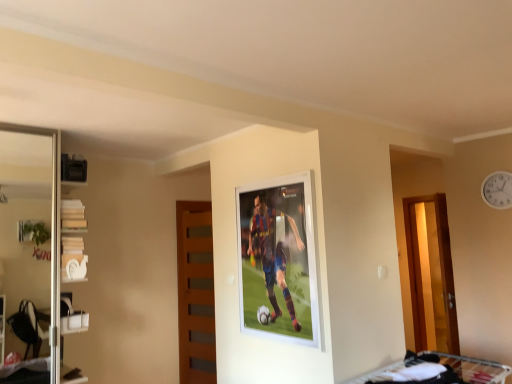
Question: From the image's perspective, is white glossy shelves at left above or below white fabric bunk bed at lower right?

Choices:
 (A) above
 (B) below

Answer: (A)

Question: Do you think white glossy shelves at left is within white fabric bunk bed at lower right, or outside of it?

Choices:
 (A) inside
 (B) outside

Answer: (B)

Question: Estimate the real-world distances between objects in this image. Which object is farther from the white fabric bunk bed at lower right?

Choices:
 (A) wooden at center
 (B) transparent glass screen door at left
 (C) white glossy shelves at left
 (D) white plastic clock at upper right

Answer: (B)

Question: Which object is the closest to the transparent glass screen door at left?

Choices:
 (A) white glossy shelves at left
 (B) white fabric bunk bed at lower right
 (C) white plastic clock at upper right
 (D) wooden at center

Answer: (A)